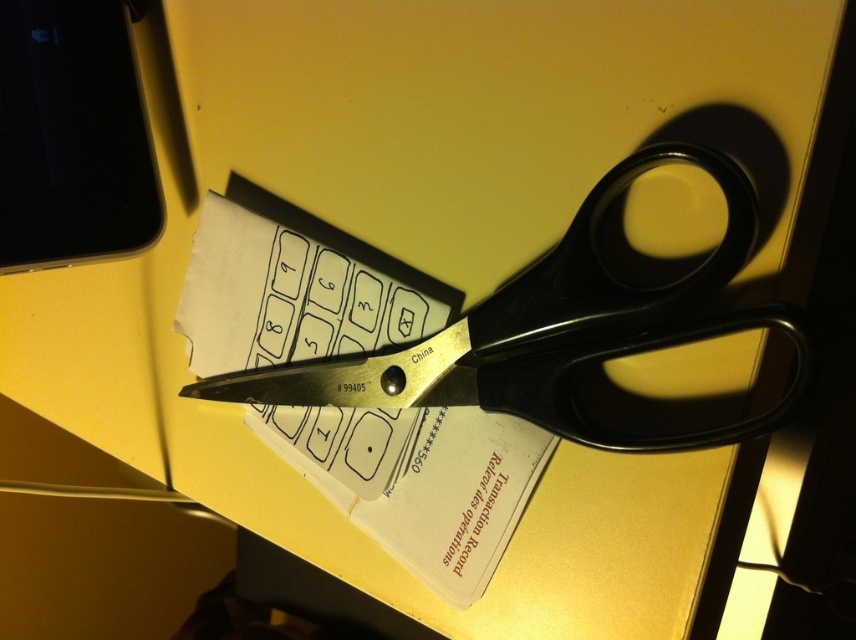
You are a photographer trying to capture a closeup of the keypad layout on the paper. The scissors are in the way. If you move the scissors to the point at coordinate point (197, 337), will the scissors be closer to or farther from the camera compared to their current position?

The point at coordinate point (197, 337) is 34.67 inches from the camera. Since the scissors are currently resting on the paper, their current distance from the camera is not specified, but moving them to the given point would place them 34.67 inches away, so the answer depends on their original position. However, based on the provided information, we can only state the new position is 34.67 inches from the camera.

You are holding a camera and want to take a closeup photo of the white paper at center. The camera requires the subject to be at least 30 inches away for focus. Can you take the photo without moving the camera?

The white paper at center is 30.34 inches away from camera, so yes, you can take the photo without moving the camera since the distance meets the minimum requirement of 30 inches.

In the scene shown: You are a technician trying to repair a device. You see the white paper at center at point (418, 481). Is this the correct location to place the scissors to cut the paper?

The white paper at center is located at point (418, 481). Since the scissors are positioned over the paper, placing them at this point would allow for cutting the paper effectively.